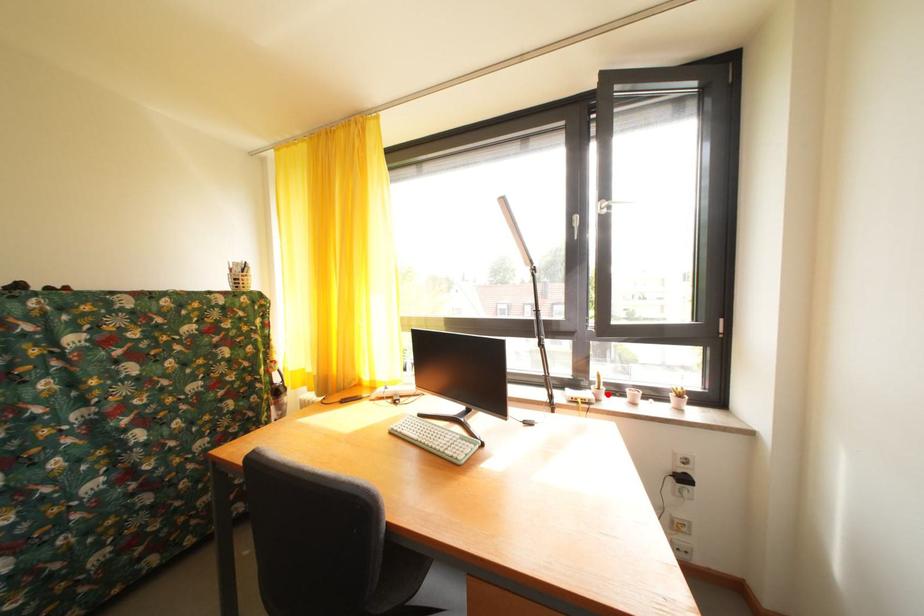
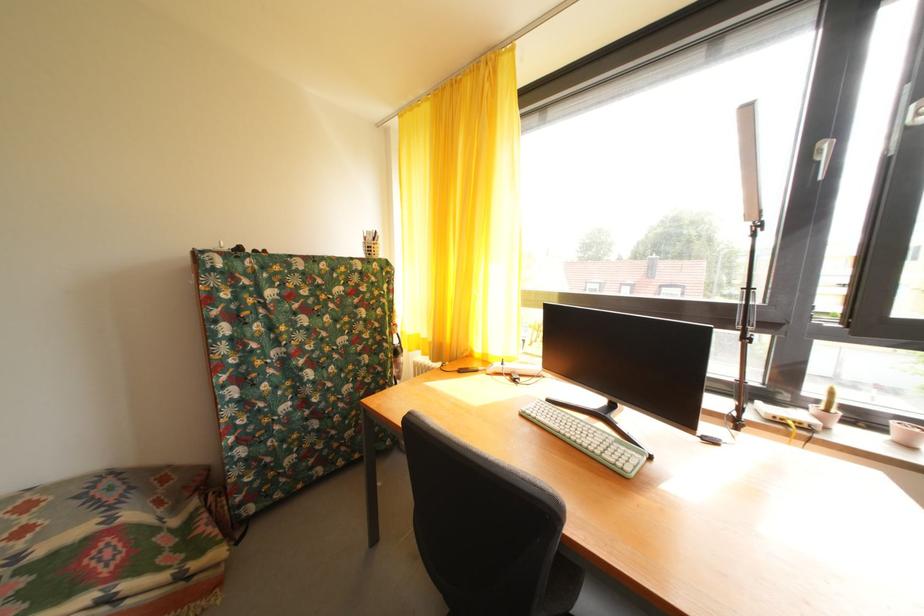
Locate, in the second image, the point that corresponds to the highlighted location in the first image.

(836, 416)